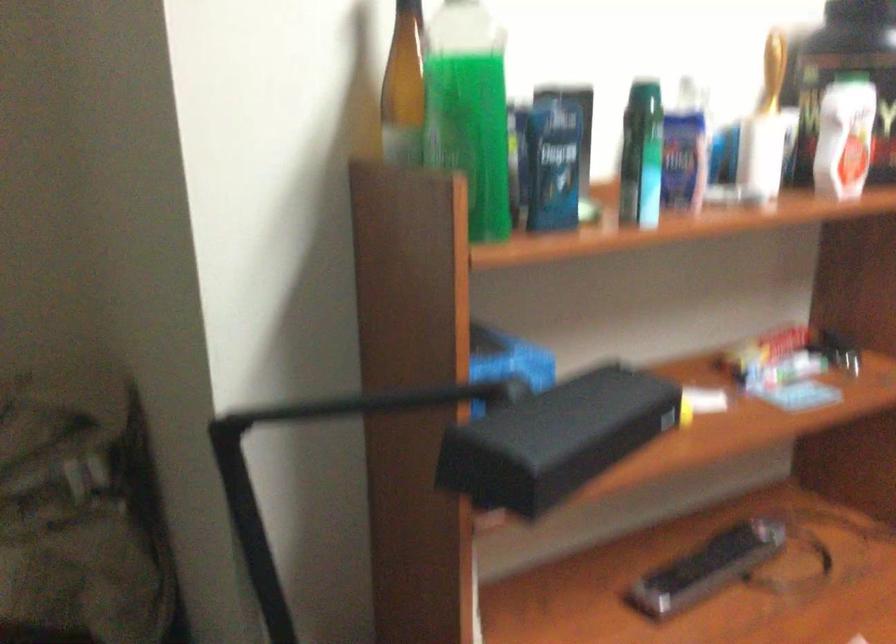
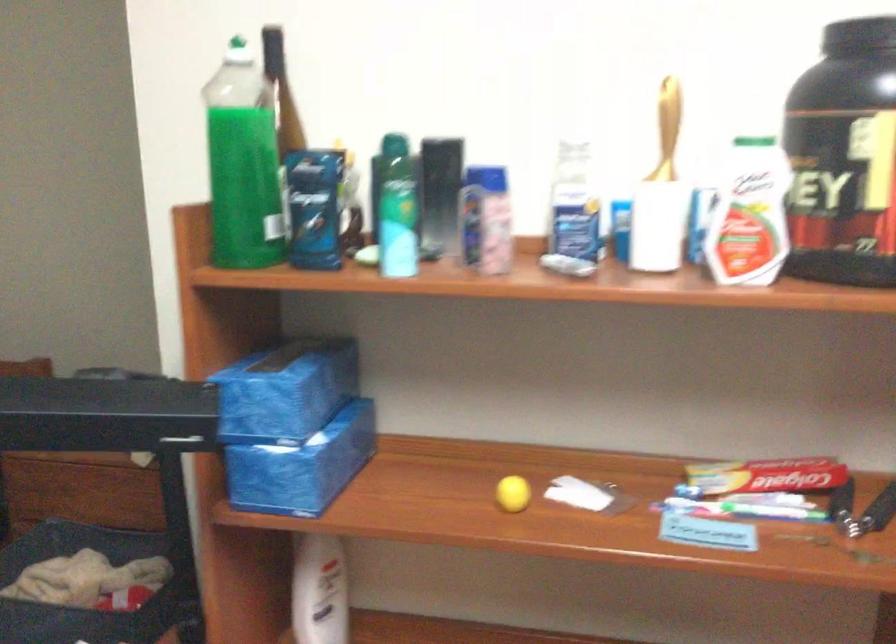
Locate, in the second image, the point that corresponds to [547,363] in the first image.

(286, 391)